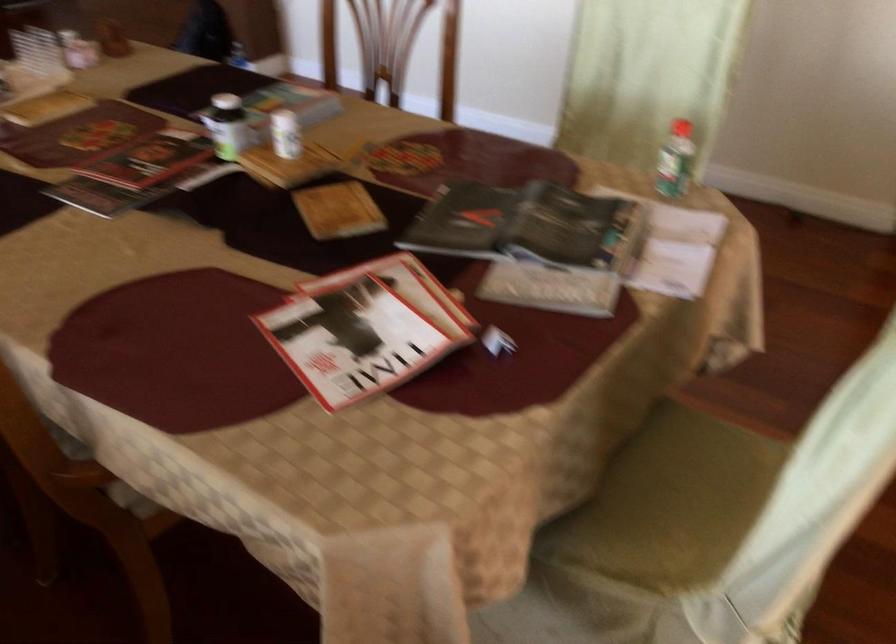
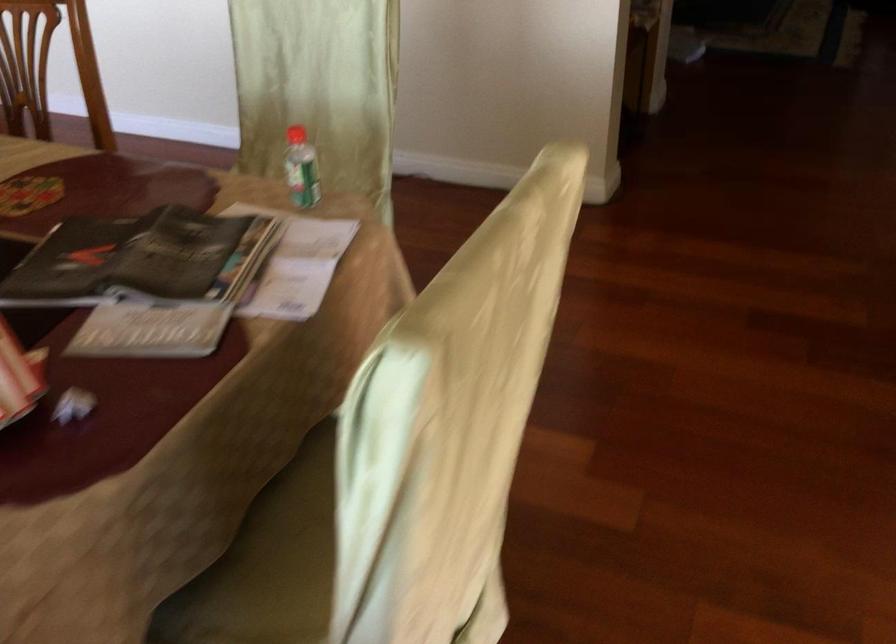
Question: The first image is from the beginning of the video and the second image is from the end. How did the camera likely rotate when shooting the video?

Choices:
 (A) Left
 (B) Right
 (C) Up
 (D) Down

Answer: (B)